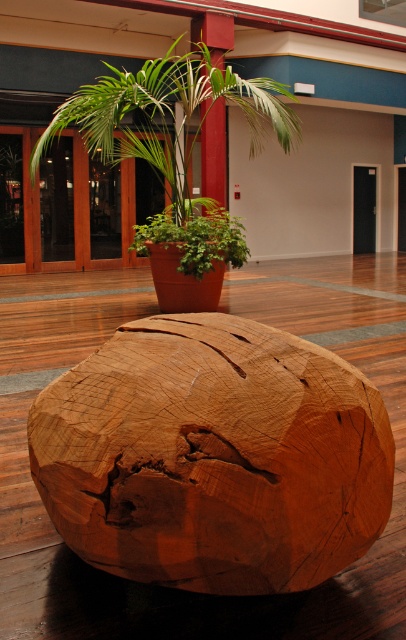
You are arranging a display in a store and need to place a tall vase between the wooden sphere at center and the green leafy plant at center. Which object should the vase be placed closer to?

The vase should be placed closer to the green leafy plant at center because the wooden sphere at center is shorter than the green leafy plant at center, so positioning the vase near the taller plant would create a balanced arrangement.

You are arranging flowers in this room and see two green leafy plants. One is the green leafy plant at upper center and the other is the green leafy plant at center. Which one is positioned to the right side of the other?

The green leafy plant at upper center is positioned to the right of the green leafy plant at center.

You are standing in the room and want to place a new decorative item on the spot marked by the coordinates point [166,115]. What object is currently occupying that location?

The green leafy plant at upper center is located at point [166,115].